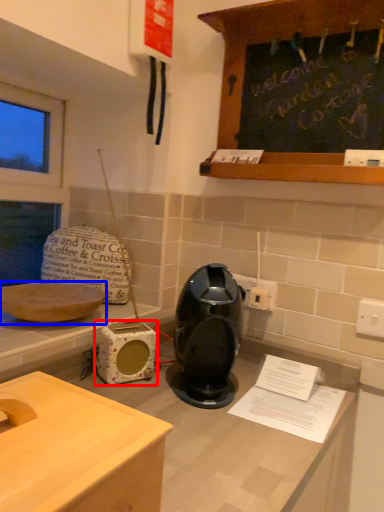
Question: Among these objects, which one is nearest to the camera, appliance (highlighted by a red box) or kitchen appliance (highlighted by a blue box)?

Choices:
 (A) appliance
 (B) kitchen appliance

Answer: (B)